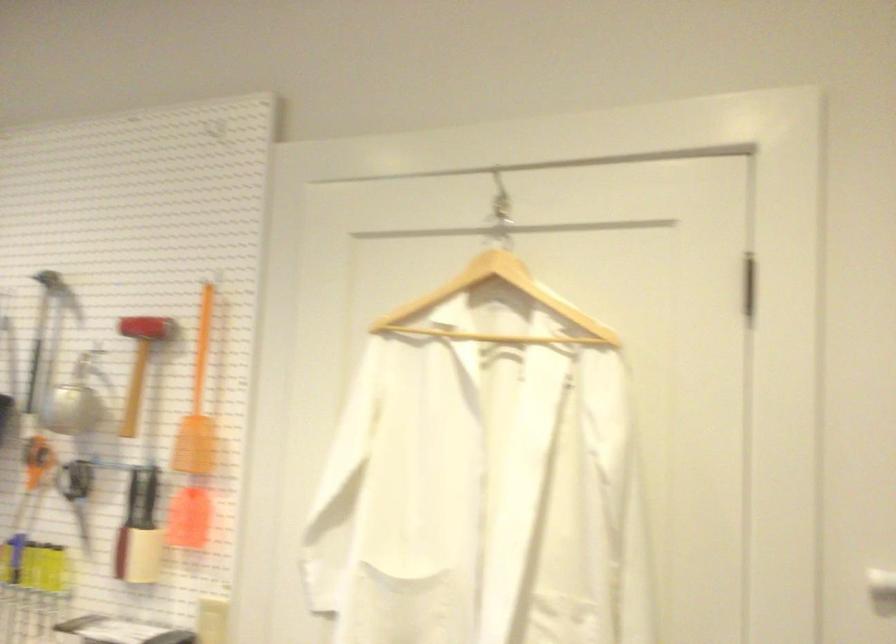
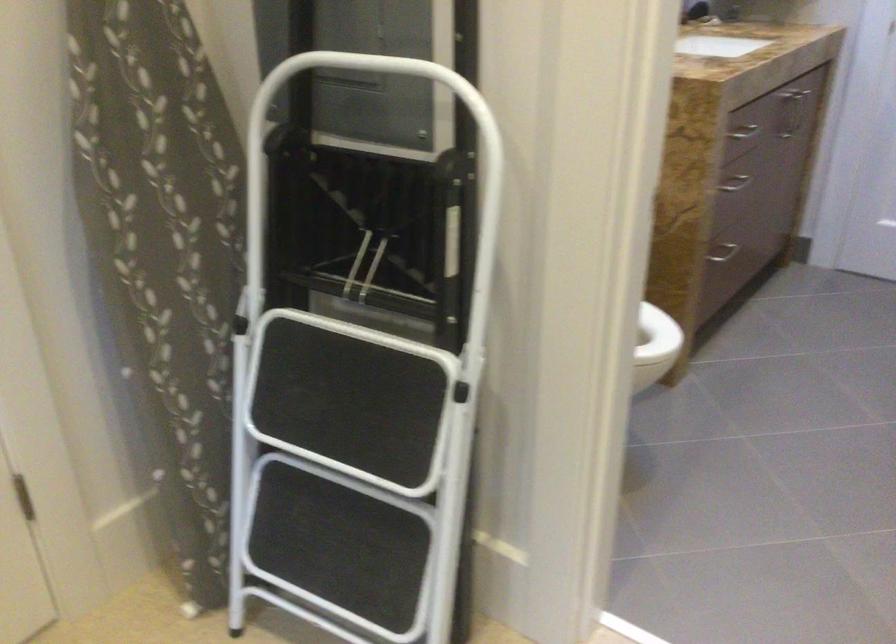
How did the camera likely rotate?

The camera rotated toward right-down.